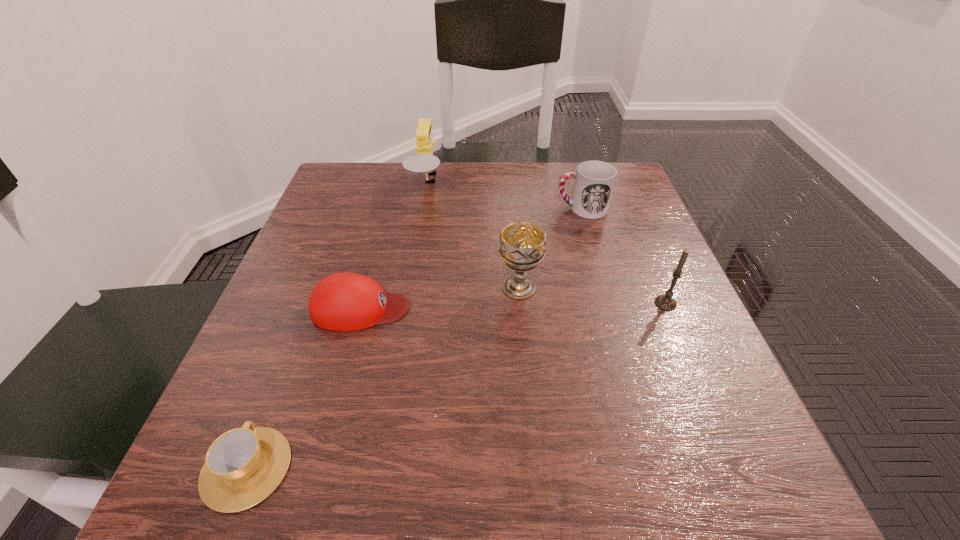
I want to click on vacant space that satisfies the following two spatial constraints: 1. on the front side of the fourth object from left to right; 2. on the front-facing side of the fifth tallest object, so click(521, 308).

At what (x,y) coordinates should I click in order to perform the action: click on vacant region that satisfies the following two spatial constraints: 1. on the front-facing side of the sponge; 2. on the back side of the chalice. Please return your answer as a coordinate pair (x, y). The image size is (960, 540). Looking at the image, I should click on (410, 288).